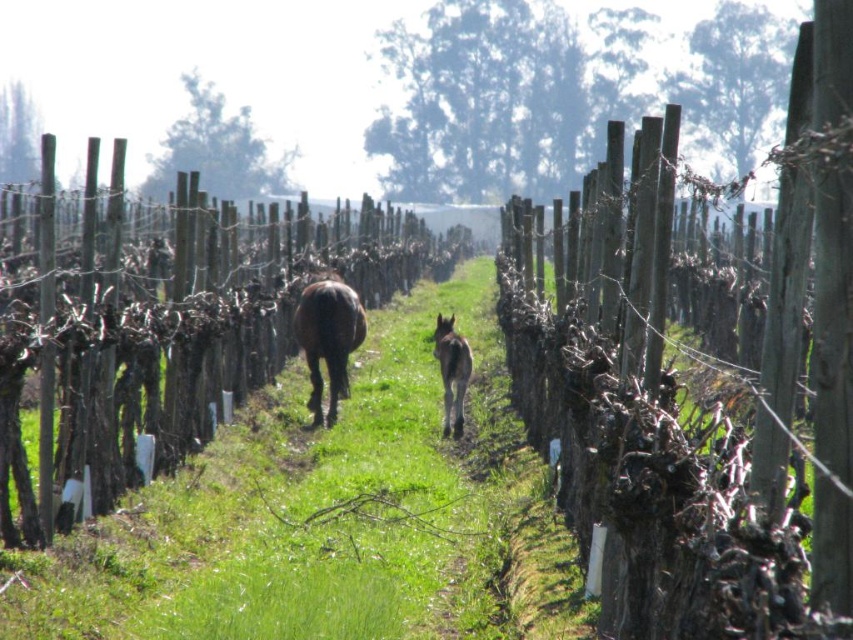
This screenshot has height=640, width=853. I want to click on wooden fence at center, so click(x=714, y=416).

Is the position of wooden fence at center more distant than that of wooden post at center?

No, it is in front of wooden post at center.

This screenshot has height=640, width=853. I want to click on wooden fence at center, so click(x=714, y=416).

Is point (10, 516) closer to camera compared to point (329, 416)?

Yes, point (10, 516) is closer to viewer.

Is wooden post at center to the right of brown glossy horse at center from the viewer's perspective?

In fact, wooden post at center is to the left of brown glossy horse at center.

You are a GUI agent. You are given a task and a screenshot of the screen. Output one action in this format:
    pyautogui.click(x=<x>, y=<y>)
    Task: Click on the wooden post at center
    Image resolution: width=853 pixels, height=640 pixels.
    Given the screenshot: What is the action you would take?
    pyautogui.click(x=181, y=348)

Between wooden fence at center and green grass at center, which one appears on the left side from the viewer's perspective?

green grass at center is more to the left.

Identify the location of wooden fence at center. Image resolution: width=853 pixels, height=640 pixels. (714, 416).

The height and width of the screenshot is (640, 853). In order to click on wooden fence at center in this screenshot , I will do `click(714, 416)`.